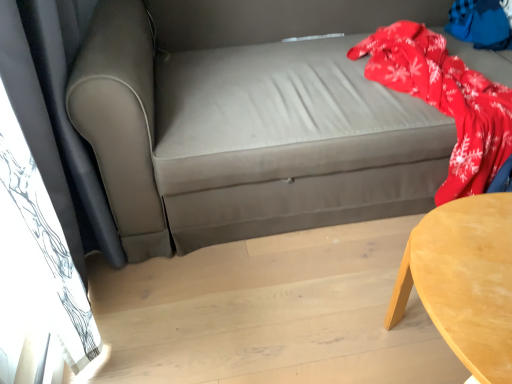
I want to click on free space above light wood table at lower right (from a real-world perspective), so click(x=474, y=254).